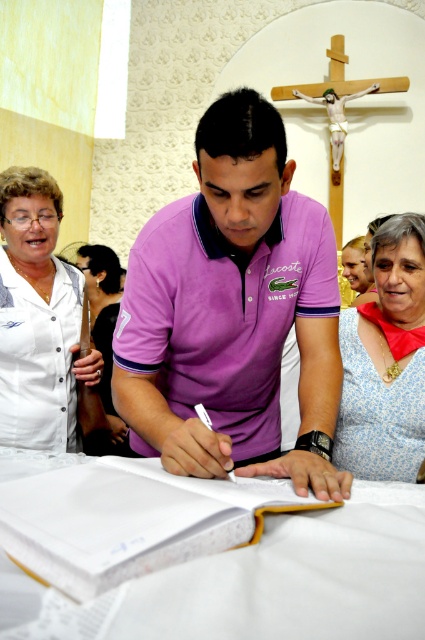
The image size is (425, 640). What do you see at coordinates (232, 312) in the screenshot?
I see `purple cotton polo shirt at center` at bounding box center [232, 312].

Is purple cotton polo shirt at center to the right of white paper book at center from the viewer's perspective?

Correct, you'll find purple cotton polo shirt at center to the right of white paper book at center.

Locate an element on the screen. The image size is (425, 640). purple cotton polo shirt at center is located at coordinates (232, 312).

Is point (33, 212) positioned after point (119, 429)?

That is False.

Can you confirm if white button-up shirt at upper left is positioned to the left of dark brown leather purse at left?

Correct, you'll find white button-up shirt at upper left to the left of dark brown leather purse at left.

Does point (48, 429) come farther from viewer compared to point (90, 417)?

No.

Where is `white button-up shirt at upper left`? white button-up shirt at upper left is located at coordinates (37, 317).

Is point (257, 291) less distant than point (112, 324)?

Yes, point (257, 291) is closer to viewer.

Who is positioned more to the right, purple cotton polo shirt at center or dark brown leather purse at left?

purple cotton polo shirt at center

This screenshot has height=640, width=425. What are the coordinates of `purple cotton polo shirt at center` in the screenshot? It's located at (232, 312).